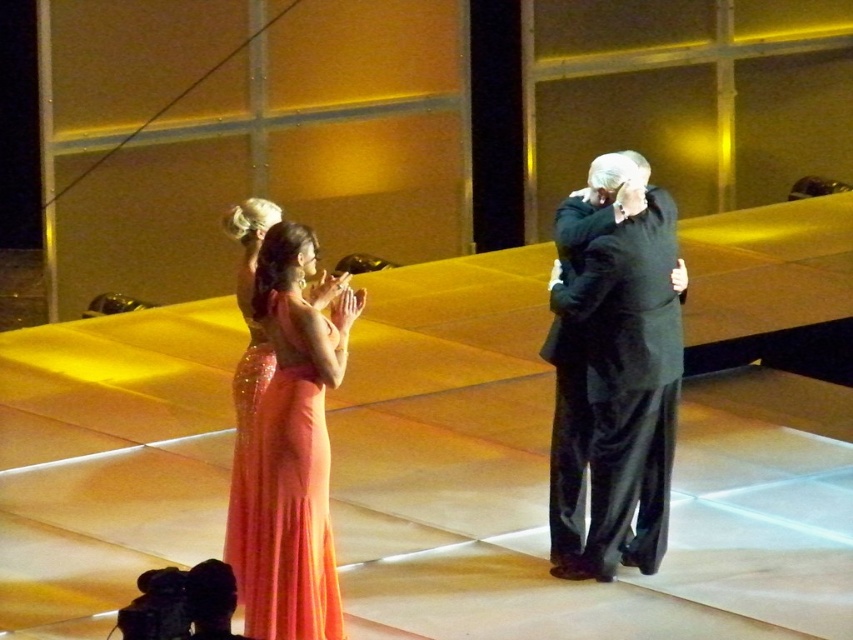
Does dark gray suit at center have a greater width compared to shiny coral gown at center?

Yes.

Locate an element on the screen. The height and width of the screenshot is (640, 853). dark gray suit at center is located at coordinates (613, 371).

Identify the location of dark gray suit at center. (613, 371).